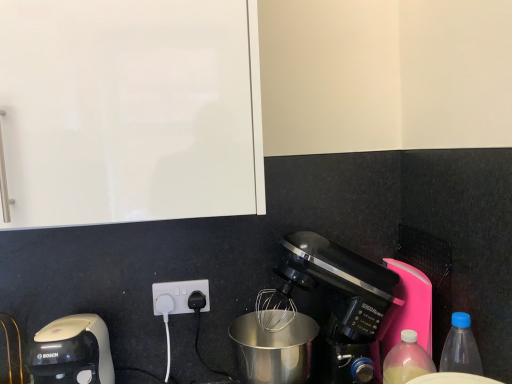
Question: Should I look upward or downward to see white plastic coffee maker at lower left, the first coffee maker positioned from the left?

Choices:
 (A) up
 (B) down

Answer: (B)

Question: Is white plastic coffee maker at lower left, the first coffee maker positioned from the left, located within translucent plastic bottle at lower right, the second bottle from the right?

Choices:
 (A) yes
 (B) no

Answer: (B)

Question: Is translucent plastic bottle at lower right, the second bottle from the right, in front of white plastic coffee maker at lower left, the first coffee maker positioned from the left?

Choices:
 (A) yes
 (B) no

Answer: (B)

Question: Is translucent plastic bottle at lower right, the second bottle from the right, outside white plastic coffee maker at lower left, marked as the 2th coffee maker in a right-to-left arrangement?

Choices:
 (A) yes
 (B) no

Answer: (A)

Question: Is translucent plastic bottle at lower right, the second bottle from the right, with white plastic coffee maker at lower left, the first coffee maker positioned from the left?

Choices:
 (A) yes
 (B) no

Answer: (B)

Question: Is translucent plastic bottle at lower right, the 1th bottle when ordered from left to right, to the left of white plastic coffee maker at lower left, the first coffee maker positioned from the left, from the viewer's perspective?

Choices:
 (A) no
 (B) yes

Answer: (A)

Question: From the image's perspective, is translucent plastic bottle at lower right, the second bottle from the right, over white plastic coffee maker at lower left, the first coffee maker positioned from the left?

Choices:
 (A) yes
 (B) no

Answer: (A)

Question: Can you see matte black coffee maker at lower right, the second coffee maker viewed from the left, touching black plastic power plugs and sockets at lower center?

Choices:
 (A) no
 (B) yes

Answer: (A)

Question: Considering the relative positions of matte black coffee maker at lower right, the second coffee maker viewed from the left, and black plastic power plugs and sockets at lower center in the image provided, is matte black coffee maker at lower right, the second coffee maker viewed from the left, behind black plastic power plugs and sockets at lower center?

Choices:
 (A) yes
 (B) no

Answer: (B)

Question: Does matte black coffee maker at lower right, the second coffee maker viewed from the left, come in front of black plastic power plugs and sockets at lower center?

Choices:
 (A) no
 (B) yes

Answer: (B)

Question: Is matte black coffee maker at lower right, which ranks as the 1th coffee maker in right-to-left order, wider than black plastic power plugs and sockets at lower center?

Choices:
 (A) no
 (B) yes

Answer: (B)

Question: Considering the relative sizes of matte black coffee maker at lower right, which ranks as the 1th coffee maker in right-to-left order, and black plastic power plugs and sockets at lower center in the image provided, is matte black coffee maker at lower right, which ranks as the 1th coffee maker in right-to-left order, thinner than black plastic power plugs and sockets at lower center?

Choices:
 (A) yes
 (B) no

Answer: (B)

Question: Is matte black coffee maker at lower right, the second coffee maker viewed from the left, aimed at black plastic power plugs and sockets at lower center?

Choices:
 (A) no
 (B) yes

Answer: (A)

Question: Is translucent plastic bottle at lower right, the second bottle from the right, beside black plastic power plugs and sockets at lower center?

Choices:
 (A) yes
 (B) no

Answer: (B)